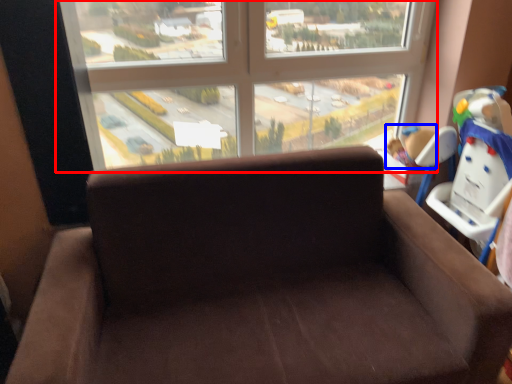
Question: Among these objects, which one is farthest to the camera, window (highlighted by a red box) or child (highlighted by a blue box)?

Choices:
 (A) window
 (B) child

Answer: (B)